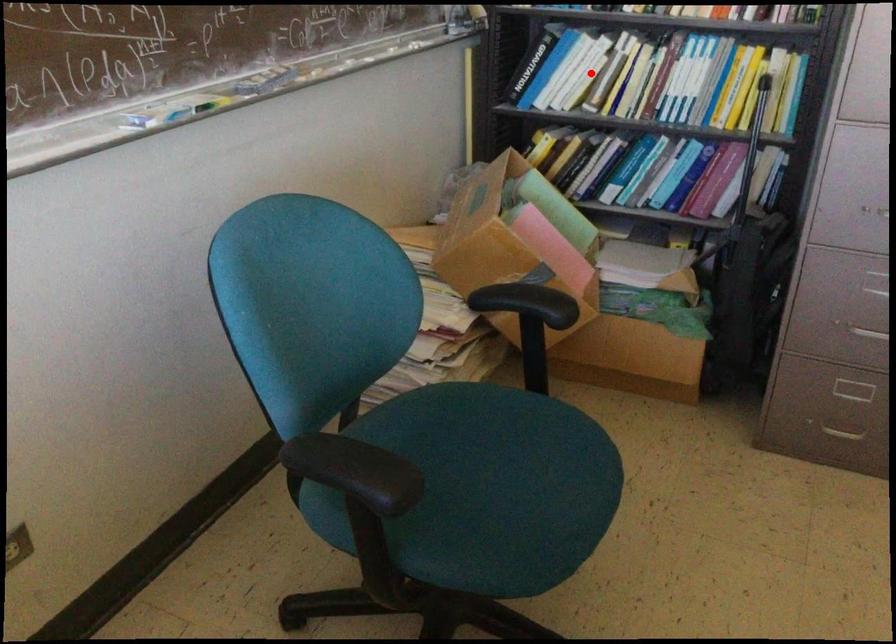
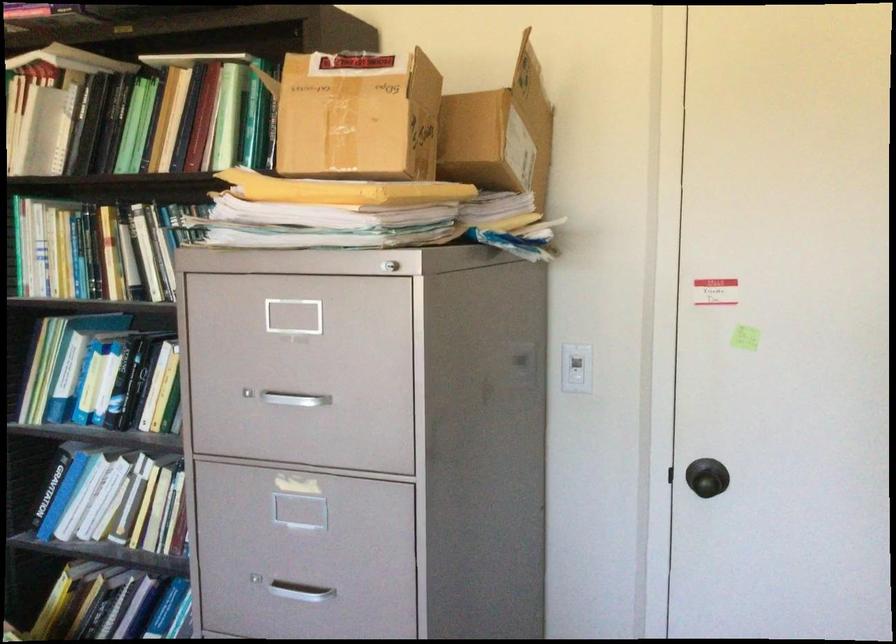
In the second image, find the point that corresponds to the highlighted location in the first image.

(117, 502)